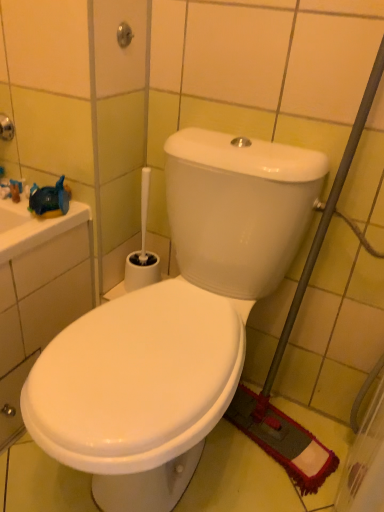
Locate an element on the screen. The image size is (384, 512). brushed metal showerhead at upper center is located at coordinates (124, 35).

Image resolution: width=384 pixels, height=512 pixels. In order to click on shower above the white plastic toilet brush at lower center (from a real-world perspective) in this screenshot , I will do `click(124, 35)`.

What's the angular difference between brushed metal showerhead at upper center and white plastic toilet brush at lower center's facing directions?

The angle between the facing direction of brushed metal showerhead at upper center and the facing direction of white plastic toilet brush at lower center is 86.7 degrees.

Considering the relative sizes of brushed metal showerhead at upper center and white plastic toilet brush at lower center in the image provided, is brushed metal showerhead at upper center taller than white plastic toilet brush at lower center?

No.

Is brushed metal showerhead at upper center completely or partially outside of white plastic toilet brush at lower center?

brushed metal showerhead at upper center is positioned outside white plastic toilet brush at lower center.

Is the depth of white glossy toilet at center less than that of brushed metal showerhead at upper center?

That is True.

Are white glossy toilet at center and brushed metal showerhead at upper center located far from each other?

No.

How far apart are white glossy toilet at center and brushed metal showerhead at upper center?

They are 22.73 inches apart.

Would you say brushed metal showerhead at upper center is part of white glossy toilet at center's contents?

Actually, brushed metal showerhead at upper center is outside white glossy toilet at center.

From a real-world perspective, does brushed metal showerhead at upper center sit lower than white glossy toilet at center?

Incorrect, from a real-world perspective, brushed metal showerhead at upper center is higher than white glossy toilet at center.

Is point (122, 37) positioned in front of point (300, 178)?

That is False.

Is the position of brushed metal showerhead at upper center more distant than that of white glossy toilet at center?

Yes, brushed metal showerhead at upper center is further from the camera.

Is there a large distance between white plastic toilet brush at lower center and brushed metal showerhead at upper center?

No.

Which object is wider, white plastic toilet brush at lower center or brushed metal showerhead at upper center?

white plastic toilet brush at lower center is wider.

Which of these two, white plastic toilet brush at lower center or brushed metal showerhead at upper center, stands shorter?

brushed metal showerhead at upper center.

Is white plastic toilet brush at lower center facing away from brushed metal showerhead at upper center?

No.

From the image's perspective, is white glossy toilet at center located beneath white plastic toilet brush at lower center?

Indeed, from the image's perspective, white glossy toilet at center is shown beneath white plastic toilet brush at lower center.

Is white glossy toilet at center outside of white plastic toilet brush at lower center?

Indeed, white glossy toilet at center is completely outside white plastic toilet brush at lower center.

Considering the sizes of objects white glossy toilet at center and white plastic toilet brush at lower center in the image provided, who is shorter, white glossy toilet at center or white plastic toilet brush at lower center?

white plastic toilet brush at lower center.

Does white glossy toilet at center have a lesser width compared to white plastic toilet brush at lower center?

Incorrect, the width of white glossy toilet at center is not less than that of white plastic toilet brush at lower center.

Is white plastic toilet brush at lower center facing towards white glossy toilet at center?

No, white plastic toilet brush at lower center is not facing towards white glossy toilet at center.

You are a GUI agent. You are given a task and a screenshot of the screen. Output one action in this format:
    pyautogui.click(x=<x>, y=<y>)
    Task: Click on the toilet below the white plastic toilet brush at lower center (from the image's perspective)
    The width and height of the screenshot is (384, 512).
    Given the screenshot: What is the action you would take?
    pyautogui.click(x=175, y=324)

Does point (127, 261) appear closer or farther from the camera than point (274, 232)?

Point (127, 261) is farther from the camera than point (274, 232).

Which object is closer to the camera taking this photo, white plastic toilet brush at lower center or white glossy toilet at center?

white glossy toilet at center is in front.

Locate an element on the screen. brush that appears below the brushed metal showerhead at upper center (from a real-world perspective) is located at coordinates (142, 249).

You are a GUI agent. You are given a task and a screenshot of the screen. Output one action in this format:
    pyautogui.click(x=<x>, y=<y>)
    Task: Click on the shower behind the white glossy toilet at center
    The image size is (384, 512).
    Given the screenshot: What is the action you would take?
    pyautogui.click(x=124, y=35)

Looking at the image, which one is located closer to brushed metal showerhead at upper center, white plastic toilet brush at lower center or white glossy toilet at center?

The object closer to brushed metal showerhead at upper center is white plastic toilet brush at lower center.

Which object lies nearer to the anchor point white plastic toilet brush at lower center, brushed metal showerhead at upper center or white glossy toilet at center?

white glossy toilet at center is closer to white plastic toilet brush at lower center.

Considering their positions, is white plastic toilet brush at lower center positioned further to white glossy toilet at center than brushed metal showerhead at upper center?

Among the two, brushed metal showerhead at upper center is located further to white glossy toilet at center.

Which object lies nearer to the anchor point white glossy toilet at center, brushed metal showerhead at upper center or white plastic toilet brush at lower center?

white plastic toilet brush at lower center.

Looking at the image, which one is located further to brushed metal showerhead at upper center, white glossy toilet at center or white plastic toilet brush at lower center?

white glossy toilet at center is further to brushed metal showerhead at upper center.

Estimate the real-world distances between objects in this image. Which object is further from white plastic toilet brush at lower center, white glossy toilet at center or brushed metal showerhead at upper center?

brushed metal showerhead at upper center lies further to white plastic toilet brush at lower center than the other object.

The height and width of the screenshot is (512, 384). In order to click on shower positioned between white glossy toilet at center and white plastic toilet brush at lower center from near to far in this screenshot , I will do `click(124, 35)`.